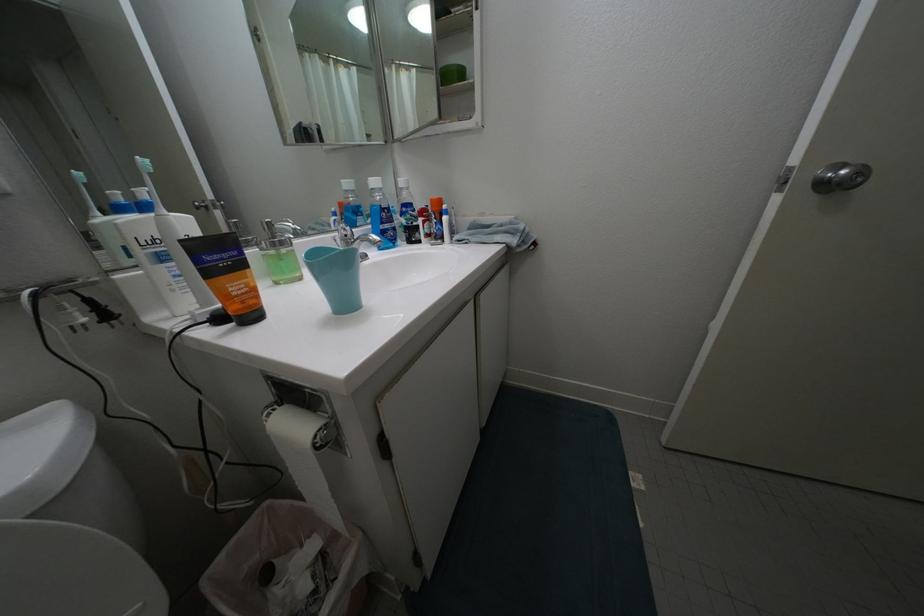
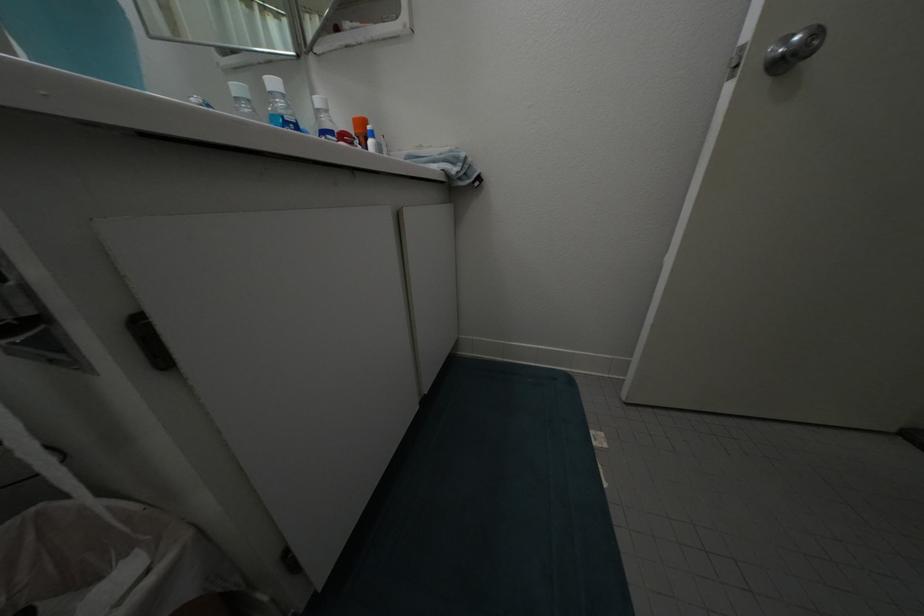
Which direction would the cameraman need to move to produce the second image?

The cameraman moved toward right, forward.